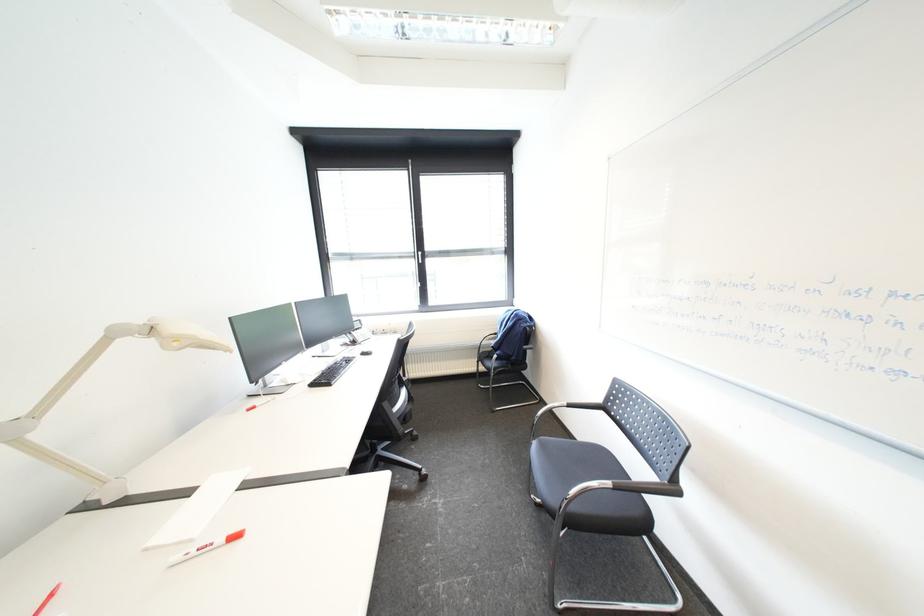
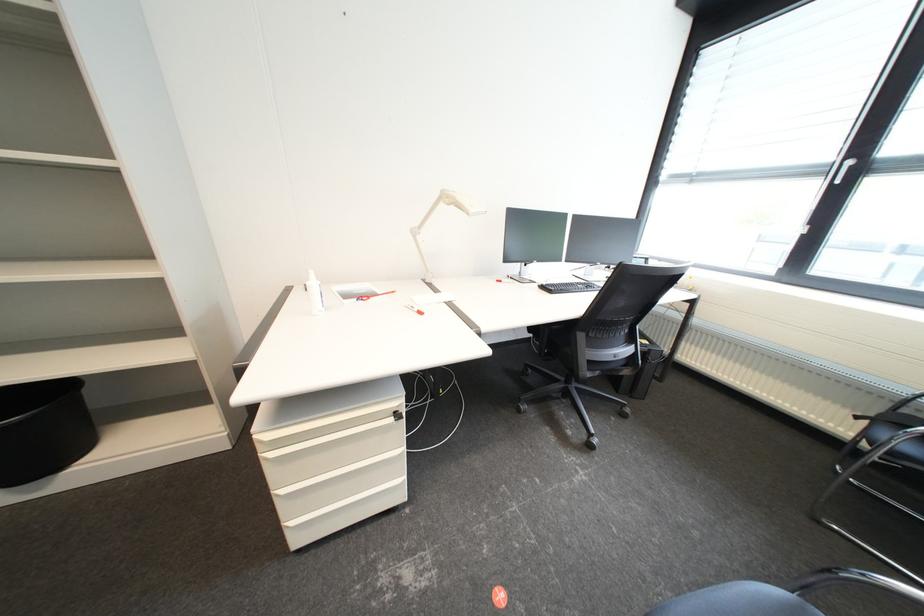
Based on the continuous images, in which direction is the camera rotating?

The rotation direction of the camera is left-down.